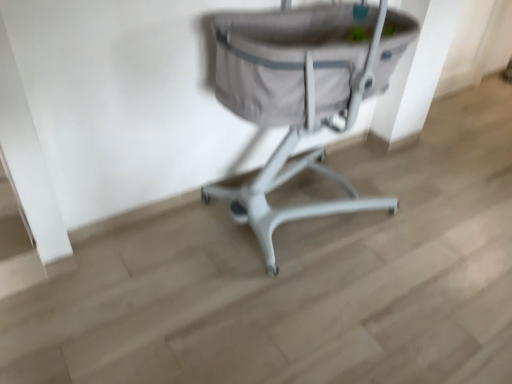
What do you see at coordinates (302, 93) in the screenshot? I see `white plastic baby swing at center` at bounding box center [302, 93].

Locate an element on the screen. white plastic baby swing at center is located at coordinates (302, 93).

This screenshot has height=384, width=512. Find the location of `white plastic baby swing at center`. white plastic baby swing at center is located at coordinates (302, 93).